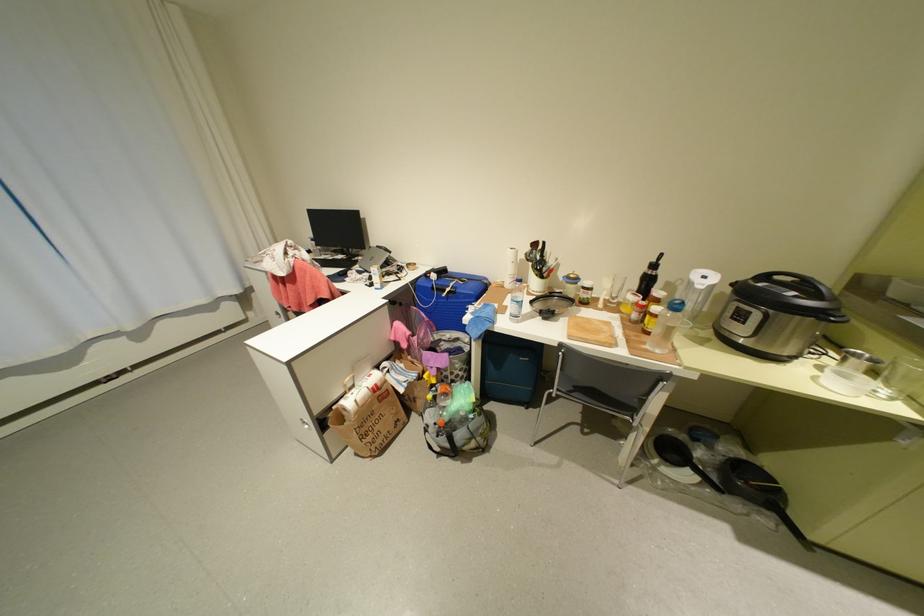
Where would you lift the blue cooler handle? Please return your answer as a coordinate pair (x, y).

(444, 278)